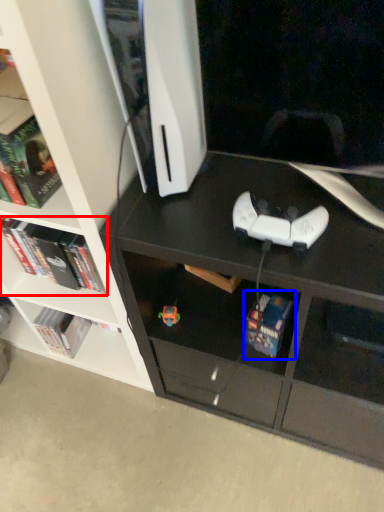
Question: Which point is closer to the camera, book (highlighted by a red box) or book (highlighted by a blue box)?

Choices:
 (A) book
 (B) book

Answer: (B)